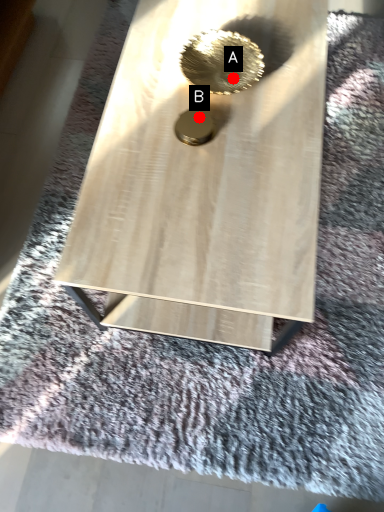
Question: Two points are circled on the image, labeled by A and B beside each circle. Which point appears closest to the camera in this image?

Choices:
 (A) A is closer
 (B) B is closer

Answer: (A)